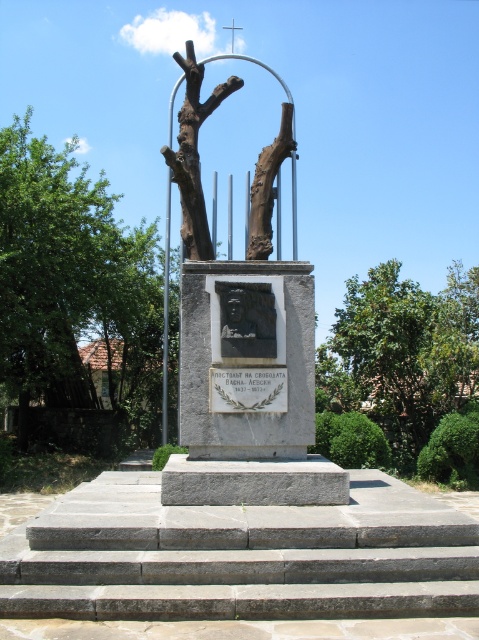
Is point (301, 326) closer to viewer compared to point (239, 330)?

No, (301, 326) is further to viewer.

What do you see at coordinates (243, 412) in the screenshot? The width and height of the screenshot is (479, 640). I see `rustic stone sculpture at center` at bounding box center [243, 412].

Locate an element on the screen. This screenshot has width=479, height=640. rustic stone sculpture at center is located at coordinates (243, 412).

Consider the image. Who is positioned more to the left, black stone relief at center or white stone plaque at center?

black stone relief at center is more to the left.

Identify the location of black stone relief at center. The height and width of the screenshot is (640, 479). (247, 320).

At what (x,y) coordinates should I click in order to perform the action: click on black stone relief at center. Please return your answer as a coordinate pair (x, y). This screenshot has width=479, height=640. Looking at the image, I should click on (247, 320).

Between point (223, 448) and point (238, 397), which one is positioned behind?

The point (223, 448) is more distant.

Between rustic stone sculpture at center and white stone plaque at center, which one has more height?

With more height is rustic stone sculpture at center.

Describe the element at coordinates (243, 412) in the screenshot. I see `rustic stone sculpture at center` at that location.

The image size is (479, 640). Identify the location of rustic stone sculpture at center. (243, 412).